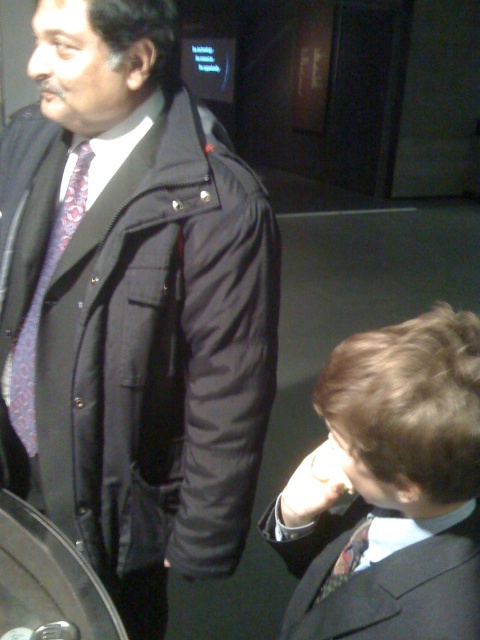
Does matte black coat at center appear on the left side of matte black tie at lower right?

Yes, matte black coat at center is to the left of matte black tie at lower right.

Is matte black coat at center wider than matte black tie at lower right?

Indeed, matte black coat at center has a greater width compared to matte black tie at lower right.

The image size is (480, 640). I want to click on matte black coat at center, so click(x=135, y=305).

Which of these two, matte black coat at center or matte black suit at lower right, stands taller?

With more height is matte black coat at center.

Is matte black coat at center below matte black suit at lower right?

Actually, matte black coat at center is above matte black suit at lower right.

Between point (262, 216) and point (313, 477), which one is positioned behind?

The point (262, 216) is more distant.

Find the location of `matte black coat at center`. matte black coat at center is located at coordinates (135, 305).

Consider the image. Who is taller, matte black suit at lower right or matte floral tie at left?

Standing taller between the two is matte floral tie at left.

Between point (446, 570) and point (35, 452), which one is positioned in front?

Point (446, 570) is more forward.

Is point (284, 636) positioned behind point (84, 204)?

No, it is not.

At what (x,y) coordinates should I click in order to perform the action: click on matte black suit at lower right. Please return your answer as a coordinate pair (x, y). Looking at the image, I should click on (388, 488).